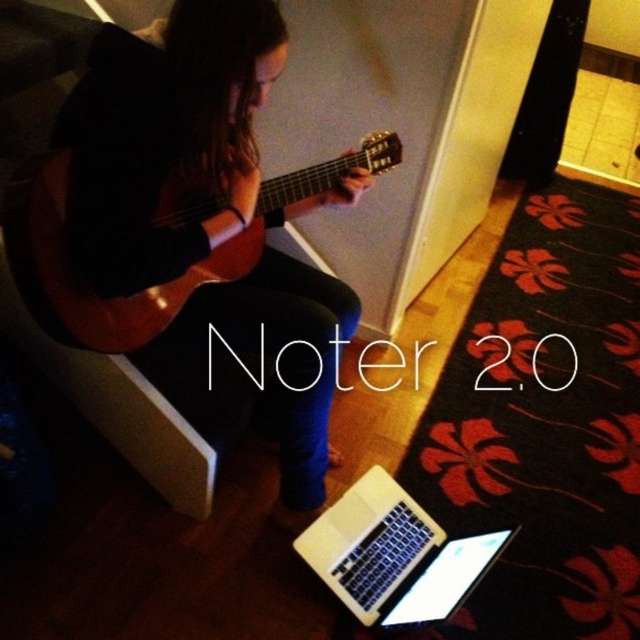
Between wooden acoustic guitar at center and white glossy laptop at lower center, which one is positioned lower?

white glossy laptop at lower center is lower down.

Which is above, wooden acoustic guitar at center or white glossy laptop at lower center?

Positioned higher is wooden acoustic guitar at center.

Who is more forward, (81, 340) or (388, 481)?

Point (81, 340) is more forward.

Find the location of a particular element. This screenshot has height=640, width=640. wooden acoustic guitar at center is located at coordinates (154, 285).

Between matte black guitar at center and white glossy laptop at lower center, which one has more height?

Standing taller between the two is matte black guitar at center.

Who is more distant from viewer, [256,3] or [442,547]?

The point [442,547] is behind.

I want to click on matte black guitar at center, so click(164, 134).

Does matte black guitar at center have a larger size compared to wooden acoustic guitar at center?

Yes, matte black guitar at center is bigger than wooden acoustic guitar at center.

At what (x,y) coordinates should I click in order to perform the action: click on matte black guitar at center. Please return your answer as a coordinate pair (x, y). The height and width of the screenshot is (640, 640). Looking at the image, I should click on (164, 134).

I want to click on matte black guitar at center, so click(164, 134).